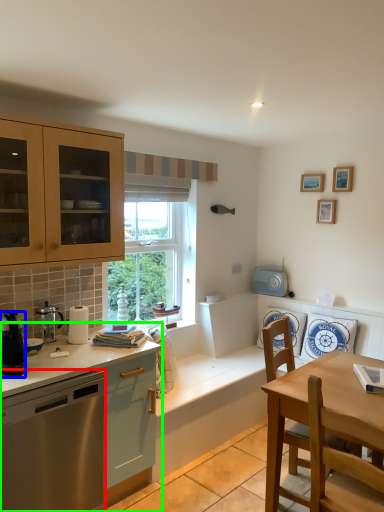
Question: Which object is positioned closest to dishwasher (highlighted by a red box)? Select from kitchen appliance (highlighted by a blue box) and countertop (highlighted by a green box).

Choices:
 (A) kitchen appliance
 (B) countertop

Answer: (B)